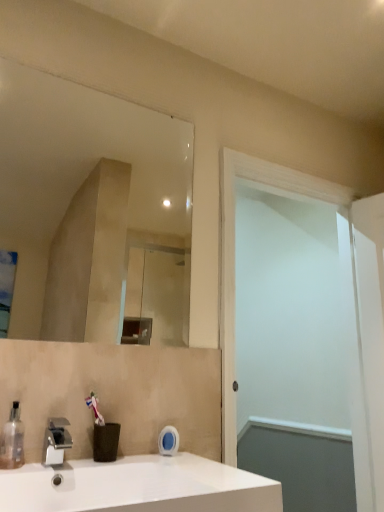
Question: Looking at their shapes, would you say transparent plastic soap dispenser at lower left is wider or thinner than white glossy sink at lower left?

Choices:
 (A) wide
 (B) thin

Answer: (B)

Question: In terms of size, does transparent plastic soap dispenser at lower left appear bigger or smaller than white glossy sink at lower left?

Choices:
 (A) big
 (B) small

Answer: (B)

Question: Based on their relative distances, which object is nearer to the clear glass mirror at upper center?

Choices:
 (A) transparent plastic soap dispenser at lower left
 (B) silver metallic faucet at lower left
 (C) white matte screen door at right
 (D) white glossy sink at lower left

Answer: (C)

Question: Which object is positioned closest to the clear glass mirror at upper center?

Choices:
 (A) white glossy sink at lower left
 (B) silver metallic faucet at lower left
 (C) transparent plastic soap dispenser at lower left
 (D) white matte screen door at right

Answer: (D)